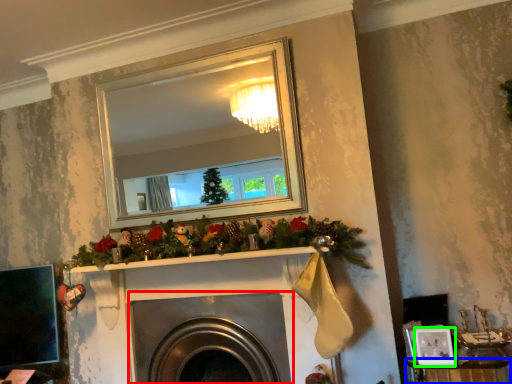
Question: Which object is the closest to the fireplace (highlighted by a red box)? Choose among these: furniture (highlighted by a blue box) or picture frame (highlighted by a green box).

Choices:
 (A) furniture
 (B) picture frame

Answer: (A)